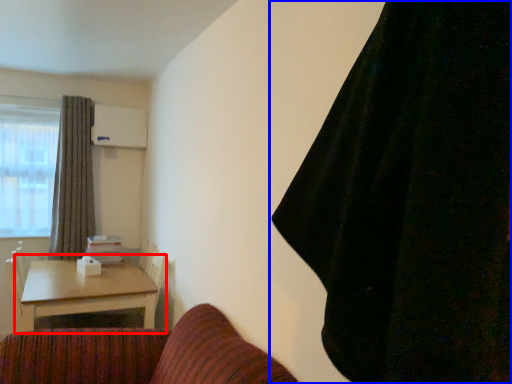
Question: Which of the following is the farthest to the observer, table (highlighted by a red box) or curtain (highlighted by a blue box)?

Choices:
 (A) table
 (B) curtain

Answer: (A)